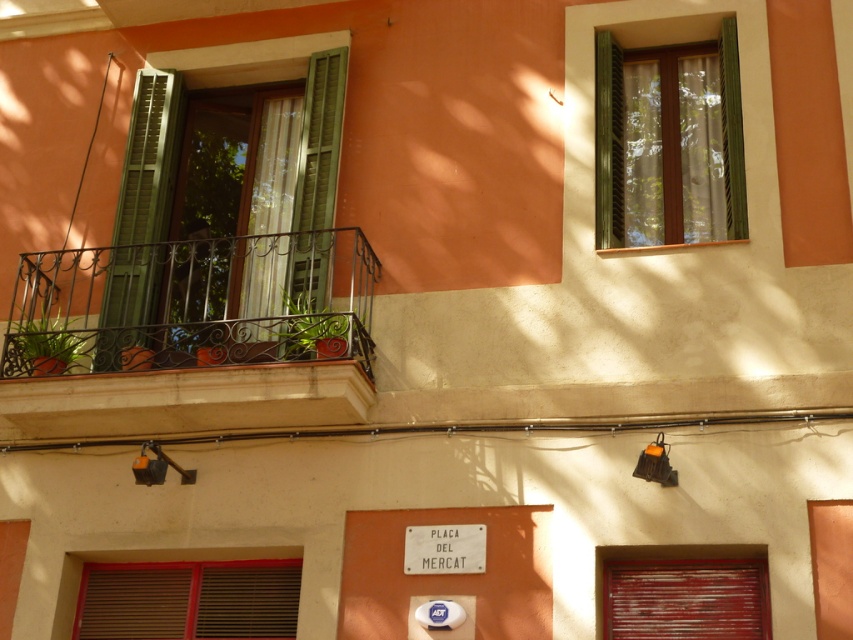
Question: Does wooden slatted shutter at lower right have a larger size compared to green matte shutter at center?

Choices:
 (A) yes
 (B) no

Answer: (B)

Question: Which point is closer to the camera?

Choices:
 (A) (x=242, y=595)
 (B) (x=107, y=358)

Answer: (A)

Question: Which of the following is the farthest from the observer?

Choices:
 (A) wooden slatted shutter at lower right
 (B) green wood window at upper right
 (C) white plastic sign at center
 (D) green matte shutter at center

Answer: (B)

Question: Is wooden slatted shutter at lower right bigger than green matte shutter at center?

Choices:
 (A) yes
 (B) no

Answer: (B)

Question: Which of the following is the closest to the observer?

Choices:
 (A) (612, 244)
 (B) (325, 349)
 (C) (306, 298)

Answer: (B)

Question: Is green wood window at upper right to the right of wooden slatted shutter at lower right from the viewer's perspective?

Choices:
 (A) yes
 (B) no

Answer: (A)